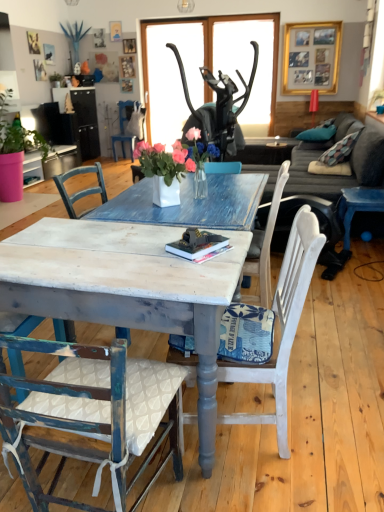
The height and width of the screenshot is (512, 384). Find the location of `free space above distressed wood table at center (from a real-world perspective)`. free space above distressed wood table at center (from a real-world perspective) is located at coordinates (106, 246).